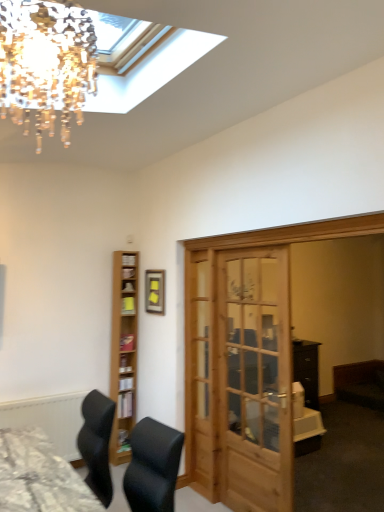
Question: Is wooden door at center in contact with textured gray desk at lower left?

Choices:
 (A) yes
 (B) no

Answer: (B)

Question: From a real-world perspective, is wooden door at center on top of textured gray desk at lower left?

Choices:
 (A) no
 (B) yes

Answer: (B)

Question: Is wooden door at center positioned behind textured gray desk at lower left?

Choices:
 (A) yes
 (B) no

Answer: (A)

Question: From the image's perspective, would you say wooden door at center is positioned over textured gray desk at lower left?

Choices:
 (A) yes
 (B) no

Answer: (A)

Question: Can you confirm if wooden door at center is shorter than textured gray desk at lower left?

Choices:
 (A) yes
 (B) no

Answer: (B)

Question: Can you confirm if wooden door at center is positioned to the right of textured gray desk at lower left?

Choices:
 (A) no
 (B) yes

Answer: (B)

Question: Would you say textured gray desk at lower left is part of crystal glass chandelier at upper left's contents?

Choices:
 (A) yes
 (B) no

Answer: (B)

Question: Does crystal glass chandelier at upper left come in front of textured gray desk at lower left?

Choices:
 (A) yes
 (B) no

Answer: (A)

Question: Is crystal glass chandelier at upper left turned away from textured gray desk at lower left?

Choices:
 (A) yes
 (B) no

Answer: (B)

Question: Is crystal glass chandelier at upper left at the left side of textured gray desk at lower left?

Choices:
 (A) yes
 (B) no

Answer: (B)

Question: Is crystal glass chandelier at upper left further to camera compared to textured gray desk at lower left?

Choices:
 (A) yes
 (B) no

Answer: (B)

Question: Can you confirm if crystal glass chandelier at upper left is thinner than textured gray desk at lower left?

Choices:
 (A) yes
 (B) no

Answer: (A)

Question: Is crystal glass chandelier at upper left not inside light brown wooden shelf at left?

Choices:
 (A) no
 (B) yes

Answer: (B)